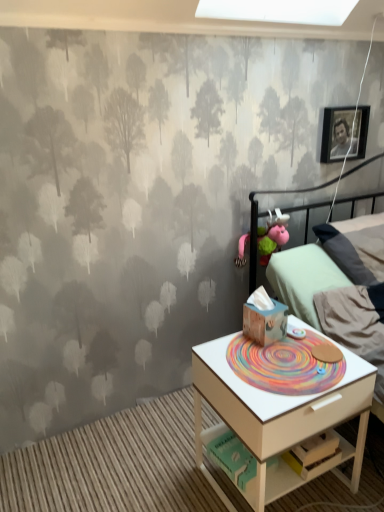
You are a GUI agent. You are given a task and a screenshot of the screen. Output one action in this format:
    pyautogui.click(x=<x>, y=<y>)
    Task: Click on the white wood drawer at lower right
    
    Given the screenshot: What is the action you would take?
    pyautogui.click(x=314, y=418)

Measure the distance between point (227, 379) and camera.

Point (227, 379) and camera are 1.31 meters apart from each other.

Measure the distance between point (239, 263) and camera.

6.56 feet.

In order to face light green fabric bed at right, should I rotate leftwards or rightwards?

Rotate right and turn 21.857 degrees.

Identify the location of white wood drawer at lower right. (314, 418).

From a real-world perspective, between white wood nightstand at lower right and matte black picture frame at upper right, who is vertically lower?

From a 3D spatial view, white wood nightstand at lower right is below.

I want to click on nightstand in front of the matte black picture frame at upper right, so click(277, 416).

Which object is positioned more to the left, white wood nightstand at lower right or matte black picture frame at upper right?

Positioned to the left is white wood nightstand at lower right.

Considering the points (356, 487) and (365, 126), which point is behind, point (356, 487) or point (365, 126)?

The point (365, 126) is behind.

What are the coordinates of `the 1st toy behind the white wood drawer at lower right` in the screenshot? It's located at (264, 319).

Is the position of white wood drawer at lower right more distant than that of wooden tissue box at center, placed as the 1th toy when sorted from bottom to top?

No, white wood drawer at lower right is closer to the camera.

From a real-world perspective, relative to wooden tissue box at center, placed as the 1th toy when sorted from bottom to top, is white wood drawer at lower right vertically above or below?

From a real-world perspective, white wood drawer at lower right is physically below wooden tissue box at center, placed as the 1th toy when sorted from bottom to top.

Considering the relative sizes of white wood nightstand at lower right and pink fabric stuffed animal at upper right, the 1th toy from the top, in the image provided, is white wood nightstand at lower right shorter than pink fabric stuffed animal at upper right, the 1th toy from the top,?

No, white wood nightstand at lower right is not shorter than pink fabric stuffed animal at upper right, the 1th toy from the top.

Which is behind, point (350, 406) or point (273, 236)?

The point (273, 236) is farther.

Which object is thinner, white wood nightstand at lower right or pink fabric stuffed animal at upper right, the 1th toy viewed from the back?

With smaller width is pink fabric stuffed animal at upper right, the 1th toy viewed from the back.

Is wooden tissue box at center, marked as the 2th toy in a top-to-bottom arrangement, not close to pink fabric stuffed animal at upper right, the second toy from the bottom?

They are positioned close to each other.

From a real-world perspective, which is physically below, wooden tissue box at center, placed as the 1th toy when sorted from front to back, or pink fabric stuffed animal at upper right, the 1th toy from the top?

From a 3D spatial view, wooden tissue box at center, placed as the 1th toy when sorted from front to back, is below.

Does wooden tissue box at center, marked as the 2th toy in a top-to-bottom arrangement, have a smaller size compared to pink fabric stuffed animal at upper right, which appears as the 2th toy when viewed from the front?

Yes, wooden tissue box at center, marked as the 2th toy in a top-to-bottom arrangement, is smaller than pink fabric stuffed animal at upper right, which appears as the 2th toy when viewed from the front.

Considering the positions of objects wooden tissue box at center, placed as the 1th toy when sorted from front to back, and pink fabric stuffed animal at upper right, the 1th toy viewed from the back, in the image provided, who is more to the right, wooden tissue box at center, placed as the 1th toy when sorted from front to back, or pink fabric stuffed animal at upper right, the 1th toy viewed from the back,?

Positioned to the right is pink fabric stuffed animal at upper right, the 1th toy viewed from the back.

Which point is more forward, (264, 237) or (340, 143)?

Point (264, 237)

Considering the sizes of objects pink fabric stuffed animal at upper right, the second toy from the bottom, and matte black picture frame at upper right in the image provided, who is taller, pink fabric stuffed animal at upper right, the second toy from the bottom, or matte black picture frame at upper right?

matte black picture frame at upper right is taller.

Considering the relative positions of pink fabric stuffed animal at upper right, the 1th toy viewed from the back, and matte black picture frame at upper right in the image provided, is pink fabric stuffed animal at upper right, the 1th toy viewed from the back, to the left or to the right of matte black picture frame at upper right?

From the image, it's evident that pink fabric stuffed animal at upper right, the 1th toy viewed from the back, is to the left of matte black picture frame at upper right.

Consider the image. From the image's perspective, between pink fabric stuffed animal at upper right, the second toy from the bottom, and matte black picture frame at upper right, which one is located above?

matte black picture frame at upper right, from the image's perspective.

Could you tell me if matte black picture frame at upper right is facing white wood drawer at lower right?

No, matte black picture frame at upper right is not oriented towards white wood drawer at lower right.

Consider the image. Considering the relative sizes of matte black picture frame at upper right and white wood drawer at lower right in the image provided, is matte black picture frame at upper right wider than white wood drawer at lower right?

No, matte black picture frame at upper right is not wider than white wood drawer at lower right.

Which object is positioned more to the left, pink fabric stuffed animal at upper right, the 1th toy viewed from the back, or light green fabric bed at right?

pink fabric stuffed animal at upper right, the 1th toy viewed from the back.

How many degrees apart are the facing directions of pink fabric stuffed animal at upper right, the second toy from the bottom, and light green fabric bed at right?

5.41 degrees separate the facing orientations of pink fabric stuffed animal at upper right, the second toy from the bottom, and light green fabric bed at right.

Is pink fabric stuffed animal at upper right, which appears as the 2th toy when viewed from the front, closer to camera compared to light green fabric bed at right?

No, it is behind light green fabric bed at right.

In order to click on picture frame behind the white wood nightstand at lower right in this screenshot , I will do point(336,133).

You are a GUI agent. You are given a task and a screenshot of the screen. Output one action in this format:
    pyautogui.click(x=<x>, y=<y>)
    Task: Click on the drawer located on the right of wooden tissue box at center, which is the second toy from back to front
    The image size is (384, 512).
    Given the screenshot: What is the action you would take?
    pyautogui.click(x=314, y=418)

From the image, which object appears to be nearer to matte black picture frame at upper right, wooden tissue box at center, which is the second toy from back to front, or white wood nightstand at lower right?

Based on the image, wooden tissue box at center, which is the second toy from back to front, appears to be nearer to matte black picture frame at upper right.

Looking at the image, which one is located closer to white wood nightstand at lower right, pink fabric stuffed animal at upper right, the 1th toy from the top, or light green fabric bed at right?

The object closer to white wood nightstand at lower right is pink fabric stuffed animal at upper right, the 1th toy from the top.

Estimate the real-world distances between objects in this image. Which object is further from white wood drawer at lower right, white wood nightstand at lower right or pink fabric stuffed animal at upper right, the 1th toy from the top?

The object further to white wood drawer at lower right is pink fabric stuffed animal at upper right, the 1th toy from the top.

Estimate the real-world distances between objects in this image. Which object is closer to white wood drawer at lower right, light green fabric bed at right or pink fabric stuffed animal at upper right, the 1th toy from the top?

Based on the image, pink fabric stuffed animal at upper right, the 1th toy from the top, appears to be nearer to white wood drawer at lower right.

Looking at the image, which one is located closer to wooden tissue box at center, marked as the 2th toy in a top-to-bottom arrangement, white wood drawer at lower right or matte black picture frame at upper right?

white wood drawer at lower right lies closer to wooden tissue box at center, marked as the 2th toy in a top-to-bottom arrangement, than the other object.

In the scene shown: Looking at the image, which one is located closer to white wood nightstand at lower right, wooden tissue box at center, marked as the 2th toy in a top-to-bottom arrangement, or white wood drawer at lower right?

The object closer to white wood nightstand at lower right is white wood drawer at lower right.

When comparing their distances from light green fabric bed at right, does pink fabric stuffed animal at upper right, the second toy from the bottom, or wooden tissue box at center, placed as the 1th toy when sorted from bottom to top, seem further?

wooden tissue box at center, placed as the 1th toy when sorted from bottom to top, is positioned further to the anchor light green fabric bed at right.

Considering their positions, is pink fabric stuffed animal at upper right, which appears as the 2th toy when viewed from the front, positioned further to white wood drawer at lower right than white wood nightstand at lower right?

pink fabric stuffed animal at upper right, which appears as the 2th toy when viewed from the front, is positioned further to the anchor white wood drawer at lower right.

Identify the location of toy between matte black picture frame at upper right and wooden tissue box at center, marked as the 2th toy in a top-to-bottom arrangement, in the vertical direction. (271, 239).

Locate an element on the screen. The width and height of the screenshot is (384, 512). nightstand between light green fabric bed at right and white wood drawer at lower right from top to bottom is located at coordinates (277, 416).

Find the location of a particular element. This screenshot has height=512, width=384. toy between light green fabric bed at right and white wood drawer at lower right in the vertical direction is located at coordinates (264, 319).

This screenshot has width=384, height=512. I want to click on bed between pink fabric stuffed animal at upper right, the 1th toy viewed from the back, and white wood drawer at lower right in the up-down direction, so coord(253,240).